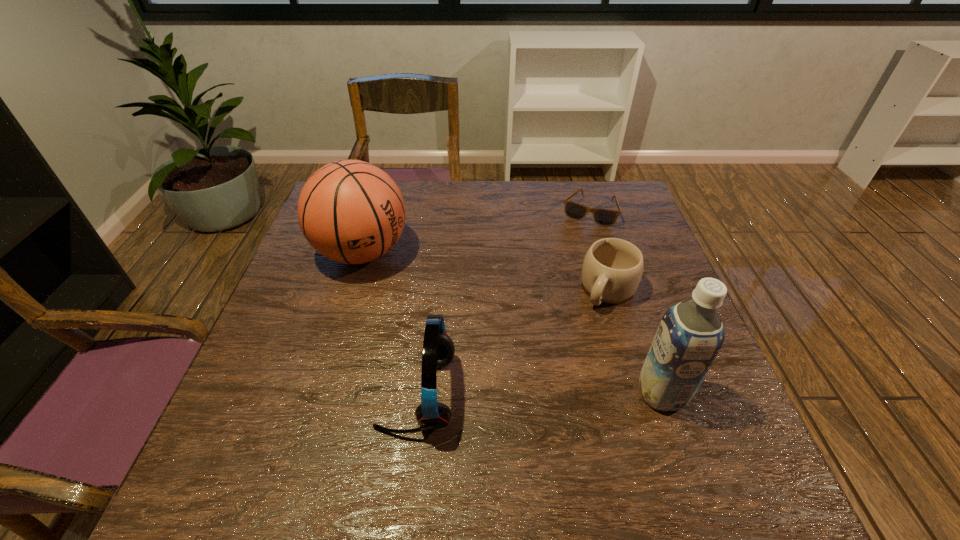
Identify the location of headset. coord(438,349).

Find the location of `soya milk`. soya milk is located at coordinates (690, 335).

Locate an element on the screen. Image resolution: width=960 pixels, height=540 pixels. sunglasses is located at coordinates (605, 217).

Identify the location of basketball. (350, 211).

Where is `mug`? Image resolution: width=960 pixels, height=540 pixels. mug is located at coordinates (612, 269).

Find the location of a particular element. Image resolution: width=960 pixels, height=540 pixels. vacant space located with the microphone attached to the side of the third tallest object is located at coordinates (235, 393).

Find the location of a particular element. This screenshot has width=960, height=540. vacant space located 0.070m with the microphone attached to the side of the third tallest object is located at coordinates [345, 393].

Where is `vacant space located with the microphone attached to the side of the third tallest object`? vacant space located with the microphone attached to the side of the third tallest object is located at coordinates (271, 393).

The width and height of the screenshot is (960, 540). Identify the location of vacant space situated on the label of the soya milk. (580, 393).

Image resolution: width=960 pixels, height=540 pixels. Identify the location of free point located 0.170m on the label of the soya milk. (555, 393).